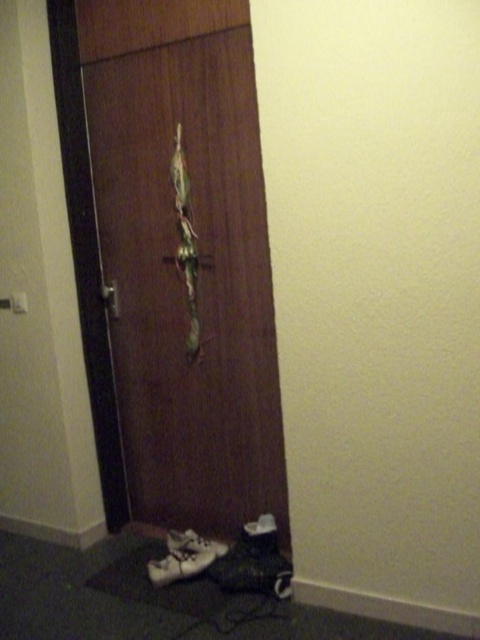
You are a delivery person trying to enter the room through the wooden door at center. The white matte shoe at lower left is blocking the door slightly. Can you open the door fully without moving the shoe?

The wooden door at center is 77.35 centimeters away from the white matte shoe at lower left. Since the distance is sufficient, you can open the door fully without moving the shoe.

You are trying to determine if the wooden door at center can be closed completely without hitting the white matte shoe at lower left. Based on their sizes, is this possible?

The wooden door at center is larger than the white matte shoe at lower left, so it can be closed without hitting the shoe.

You are trying to organize your shoes neatly. You have two white shoes on the mat. The white leather shoe at lower left and the white matte shoe at lower left. How far apart are they?

The white leather shoe at lower left is 1.52 inches away from the white matte shoe at lower left.